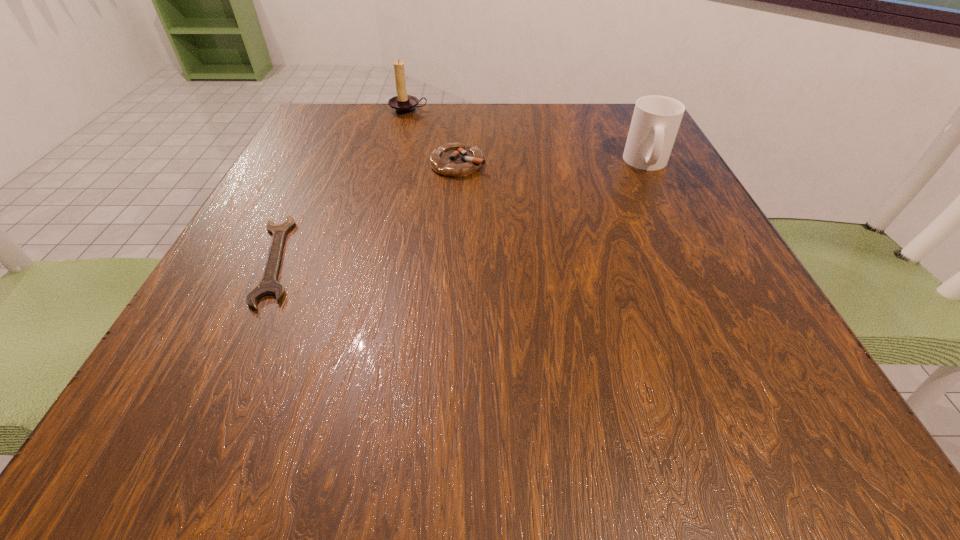
What are the coordinates of `the third object from right to left` in the screenshot? It's located at (403, 104).

The width and height of the screenshot is (960, 540). In order to click on the farthest object in this screenshot , I will do (403, 104).

You are a GUI agent. You are given a task and a screenshot of the screen. Output one action in this format:
    pyautogui.click(x=<x>, y=<y>)
    Task: Click on the mug
    
    Given the screenshot: What is the action you would take?
    pyautogui.click(x=656, y=119)

The image size is (960, 540). Identify the location of the second shortest object. (455, 160).

Locate an element on the screen. ashtray is located at coordinates [x=455, y=160].

What are the coordinates of `the shortest object` in the screenshot? It's located at (268, 285).

Where is `the nearest object`? This screenshot has width=960, height=540. the nearest object is located at coordinates (268, 285).

I want to click on vacant area situated 0.200m on the wick of the candle holder, so click(x=396, y=160).

Find the location of `vacant point located 0.390m on the handle side of the mug`. vacant point located 0.390m on the handle side of the mug is located at coordinates (736, 339).

Where is `vacant space situated 0.090m on the left of the third tallest object`? This screenshot has height=540, width=960. vacant space situated 0.090m on the left of the third tallest object is located at coordinates (386, 164).